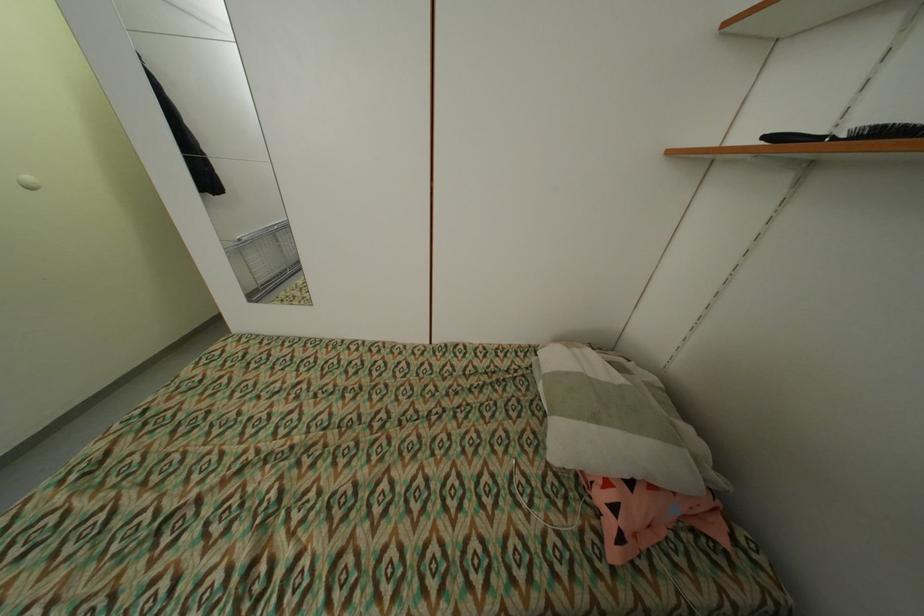
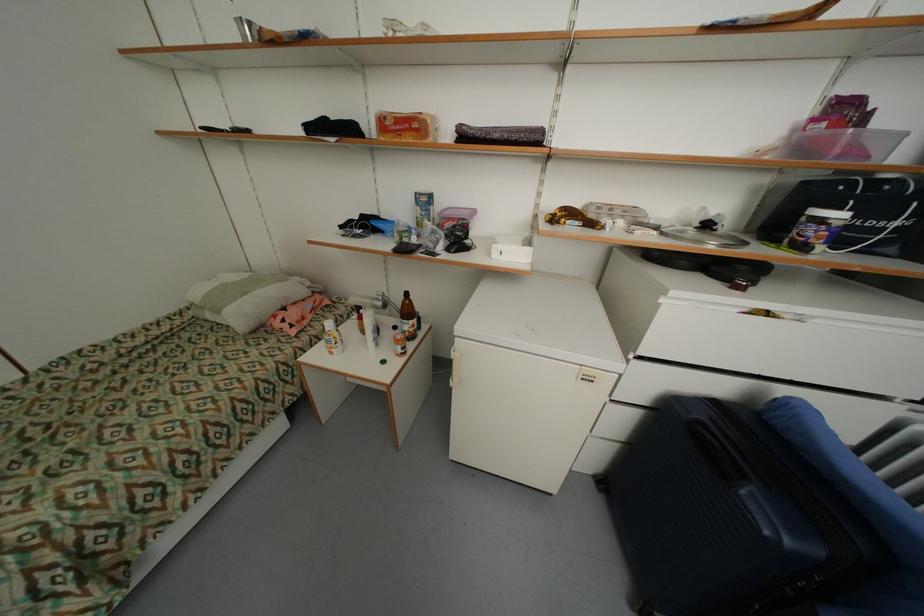
Find the pixel in the second image that matches point 688,562 in the first image.

(327, 320)